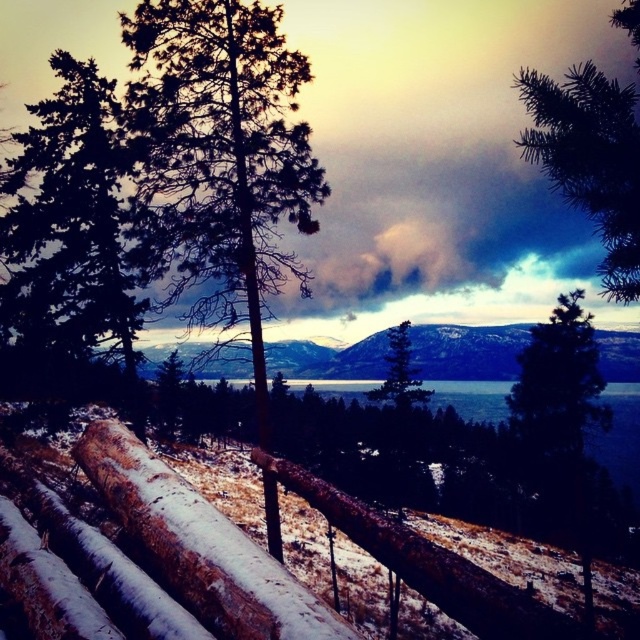
Question: Is green needle-like branches at upper right bigger than green matte tree at center?

Choices:
 (A) yes
 (B) no

Answer: (A)

Question: Among these objects, which one is nearest to the camera?

Choices:
 (A) green matte tree at center
 (B) green needle-like branches at upper right

Answer: (B)

Question: Can you confirm if slightly glossy brown log at center is positioned to the left of green matte tree at center?

Choices:
 (A) yes
 (B) no

Answer: (A)

Question: Which of the following is the farthest from the observer?

Choices:
 (A) (186, 561)
 (B) (637, 225)
 (C) (396, 378)

Answer: (C)

Question: Is slightly glossy brown log at center bigger than green needle-like branches at upper right?

Choices:
 (A) no
 (B) yes

Answer: (A)

Question: Which is farther from the slightly glossy brown log at center?

Choices:
 (A) green needle-like branches at upper right
 (B) green matte tree at center

Answer: (B)